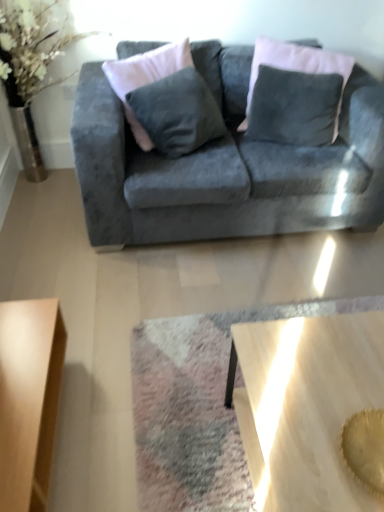
This screenshot has width=384, height=512. Identify the location of blank area to the left of wooden polished coffee table at lower center, which is the 1th coffee table from right to left. tap(165, 430).